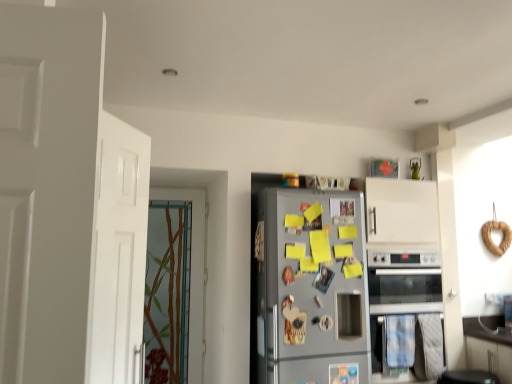
Locate an element on the screen. This screenshot has height=384, width=512. satin silver fridge at center is located at coordinates (309, 289).

Find the location of a particular element. The image size is (512, 384). satin silver oven at lower right is located at coordinates click(x=400, y=289).

Locate an element on the screen. The height and width of the screenshot is (384, 512). satin silver fridge at center is located at coordinates (309, 289).

Is point (485, 232) behind point (289, 350)?

Yes, point (485, 232) is behind point (289, 350).

Consider the image. From the image's perspective, which one is positioned higher, baked wheat bagel at right or satin silver fridge at center?

baked wheat bagel at right.

Based on the photo, relative to satin silver fridge at center, is baked wheat bagel at right in front or behind?

Clearly, baked wheat bagel at right is behind satin silver fridge at center.

Is baked wheat bagel at right oriented away from satin silver fridge at center?

No.

What's the angular difference between baked wheat bagel at right and satin silver oven at lower right's facing directions?

baked wheat bagel at right and satin silver oven at lower right are facing 1.13 degrees away from each other.

In terms of size, does baked wheat bagel at right appear bigger or smaller than satin silver oven at lower right?

baked wheat bagel at right is smaller than satin silver oven at lower right.

From the image's perspective, which object appears higher, baked wheat bagel at right or satin silver oven at lower right?

baked wheat bagel at right is shown above in the image.

Is point (509, 234) farther from viewer compared to point (373, 253)?

That is True.

From a real-world perspective, which is physically above, white matte door at left, the 2th door from the back, or translucent glass door at left, the second door from the front?

white matte door at left, the 2th door from the back, is physically above.

Find the location of a particular element. Image resolution: width=512 pixels, height=384 pixels. door below the white matte door at left, marked as the first door in a front-to-back arrangement (from the image's perspective) is located at coordinates (193, 271).

Considering the relative sizes of white matte door at left, the 2th door from the back, and translucent glass door at left, the second door from the front, in the image provided, is white matte door at left, the 2th door from the back, thinner than translucent glass door at left, the second door from the front,?

Yes.

Is baked wheat bagel at right a part of white matte door at left, the 2th door from the back?

No, baked wheat bagel at right is not a part of white matte door at left, the 2th door from the back.

Are white matte door at left, marked as the first door in a front-to-back arrangement, and baked wheat bagel at right beside each other?

They are not placed beside each other.

This screenshot has height=384, width=512. In order to click on bagel above the white matte door at left, the 2th door from the back (from a real-world perspective) in this screenshot , I will do `click(490, 237)`.

Is satin silver oven at lower right smaller than baked wheat bagel at right?

Actually, satin silver oven at lower right might be larger than baked wheat bagel at right.

Is satin silver oven at lower right facing away from baked wheat bagel at right?

No, satin silver oven at lower right is not facing away from baked wheat bagel at right.

Which point is more forward, (426, 306) or (507, 237)?

The point (426, 306) is closer.

How different are the orientations of satin silver oven at lower right and baked wheat bagel at right in degrees?

1.13 degrees separate the facing orientations of satin silver oven at lower right and baked wheat bagel at right.

From the picture: How distant is satin silver oven at lower right from translucent glass door at left, the first door in the back-to-front sequence?

satin silver oven at lower right and translucent glass door at left, the first door in the back-to-front sequence, are 1.45 meters apart from each other.

Is satin silver oven at lower right spatially inside translucent glass door at left, the first door in the back-to-front sequence, or outside of it?

satin silver oven at lower right is located beyond the bounds of translucent glass door at left, the first door in the back-to-front sequence.

Can you confirm if satin silver oven at lower right is bigger than translucent glass door at left, the first door in the back-to-front sequence?

Correct, satin silver oven at lower right is larger in size than translucent glass door at left, the first door in the back-to-front sequence.

From the image's perspective, which one is positioned lower, satin silver oven at lower right or translucent glass door at left, the first door in the back-to-front sequence?

satin silver oven at lower right, from the image's perspective.

Is satin silver fridge at center oriented towards white matte door at left, the 2th door from the back?

No, satin silver fridge at center is not facing towards white matte door at left, the 2th door from the back.

From the image's perspective, which one is positioned lower, satin silver fridge at center or white matte door at left, the 2th door from the back?

satin silver fridge at center, from the image's perspective.

Where is `refrigerator that appears behind the white matte door at left, marked as the first door in a front-to-back arrangement`? The height and width of the screenshot is (384, 512). refrigerator that appears behind the white matte door at left, marked as the first door in a front-to-back arrangement is located at coordinates (309, 289).

Identify the location of refrigerator below the baked wheat bagel at right (from the image's perspective). (309, 289).

At what (x,y) coordinates should I click in order to perform the action: click on oven located on the left of baked wheat bagel at right. Please return your answer as a coordinate pair (x, y). This screenshot has height=384, width=512. Looking at the image, I should click on (400, 289).

Looking at this image, estimate the real-world distances between objects in this image. Which object is further from satin silver oven at lower right, baked wheat bagel at right or white matte door at left, the 2th door from the back?

white matte door at left, the 2th door from the back, lies further to satin silver oven at lower right than the other object.

Which object lies nearer to the anchor point satin silver oven at lower right, white matte door at left, marked as the first door in a front-to-back arrangement, or satin silver fridge at center?

satin silver fridge at center is closer to satin silver oven at lower right.

Considering their positions, is satin silver fridge at center positioned further to white matte door at left, marked as the first door in a front-to-back arrangement, than satin silver oven at lower right?

satin silver oven at lower right is further to white matte door at left, marked as the first door in a front-to-back arrangement.

Which object lies nearer to the anchor point satin silver fridge at center, baked wheat bagel at right or translucent glass door at left, the first door in the back-to-front sequence?

The object closer to satin silver fridge at center is translucent glass door at left, the first door in the back-to-front sequence.

When comparing their distances from translucent glass door at left, the first door in the back-to-front sequence, does baked wheat bagel at right or white matte door at left, the 2th door from the back, seem closer?

white matte door at left, the 2th door from the back.

From the image, which object appears to be farther from translucent glass door at left, the first door in the back-to-front sequence, satin silver fridge at center or satin silver oven at lower right?

Among the two, satin silver oven at lower right is located further to translucent glass door at left, the first door in the back-to-front sequence.

In the scene shown: Looking at the image, which one is located closer to satin silver fridge at center, satin silver oven at lower right or white matte door at left, the 2th door from the back?

Based on the image, satin silver oven at lower right appears to be nearer to satin silver fridge at center.

Considering their positions, is satin silver oven at lower right positioned further to translucent glass door at left, the first door in the back-to-front sequence, than satin silver fridge at center?

Among the two, satin silver oven at lower right is located further to translucent glass door at left, the first door in the back-to-front sequence.

Where is `oven between white matte door at left, the 2th door from the back, and translucent glass door at left, the second door from the front, in the front-back direction`? oven between white matte door at left, the 2th door from the back, and translucent glass door at left, the second door from the front, in the front-back direction is located at coordinates (400, 289).

Where is `oven between white matte door at left, marked as the first door in a front-to-back arrangement, and baked wheat bagel at right from left to right`? oven between white matte door at left, marked as the first door in a front-to-back arrangement, and baked wheat bagel at right from left to right is located at coordinates (400, 289).

This screenshot has width=512, height=384. In order to click on refrigerator between translucent glass door at left, the first door in the back-to-front sequence, and baked wheat bagel at right in this screenshot , I will do `click(309, 289)`.

I want to click on oven located between satin silver fridge at center and baked wheat bagel at right in the left-right direction, so click(400, 289).